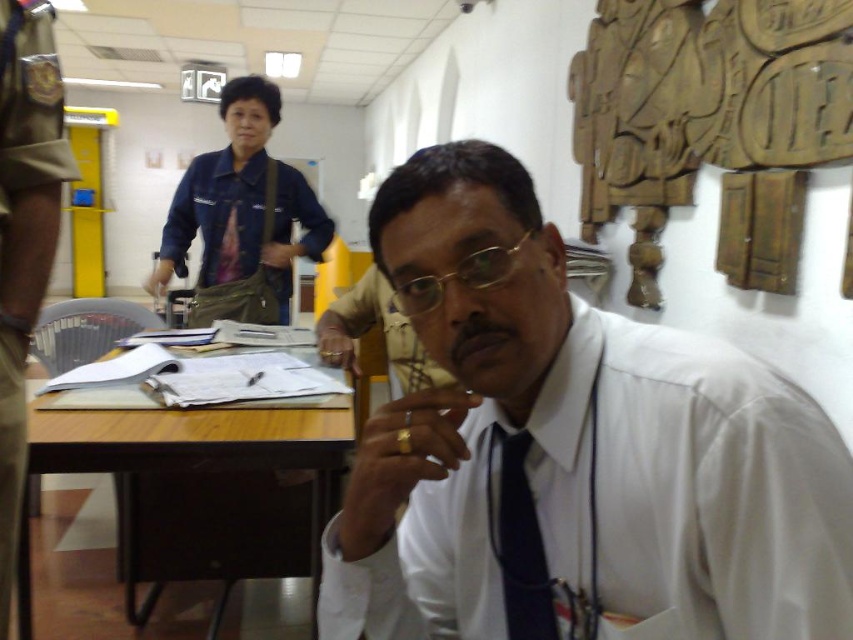
Question: Considering the real-world distances, which object is closest to the white glossy shirt at center?

Choices:
 (A) khaki uniform at left
 (B) denim jacket at upper left

Answer: (A)

Question: Which point appears closest to the camera in this image?

Choices:
 (A) (517, 637)
 (B) (242, 177)
 (C) (523, 237)

Answer: (C)

Question: Is khaki uniform at left to the left of gold-framed glasses at center from the viewer's perspective?

Choices:
 (A) no
 (B) yes

Answer: (B)

Question: Is wooden at left smaller than black silk tie at center?

Choices:
 (A) yes
 (B) no

Answer: (B)

Question: Which point is closer to the camera?

Choices:
 (A) white glossy shirt at center
 (B) gold-framed glasses at center

Answer: (A)

Question: Can you confirm if denim jacket at upper left is smaller than gold-framed glasses at center?

Choices:
 (A) yes
 (B) no

Answer: (B)